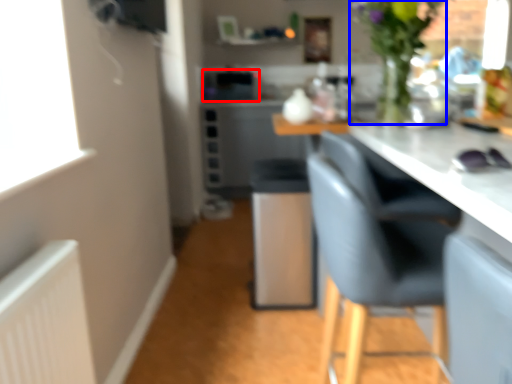
Question: Which point is further to the camera, appliance (highlighted by a red box) or floral arrangement (highlighted by a blue box)?

Choices:
 (A) appliance
 (B) floral arrangement

Answer: (A)